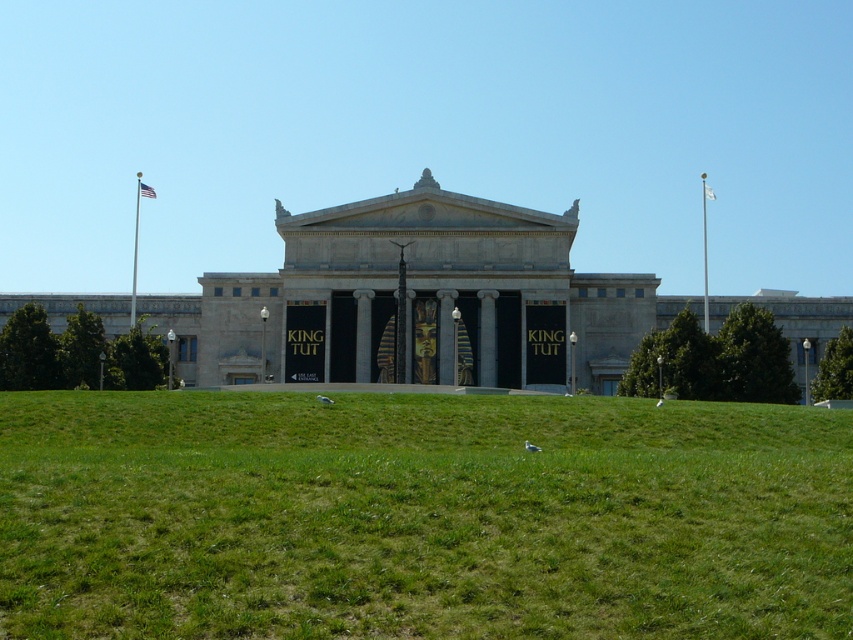
Is green grass at lower center in front of metallic flag pole at upper center?

That is True.

This screenshot has height=640, width=853. What are the coordinates of `green grass at lower center` in the screenshot? It's located at (421, 516).

Locate an element on the screen. green grass at lower center is located at coordinates (421, 516).

Does metallic flag pole at left have a smaller size compared to metallic flag pole at upper center?

Indeed, metallic flag pole at left has a smaller size compared to metallic flag pole at upper center.

Between metallic flag pole at left and metallic flag pole at upper center, which one has more height?

metallic flag pole at left is taller.

The image size is (853, 640). I want to click on metallic flag pole at left, so click(x=136, y=244).

Does green grass at lower center have a smaller size compared to metallic flag pole at left?

No.

Can you confirm if green grass at lower center is positioned to the left of metallic flag pole at left?

In fact, green grass at lower center is to the right of metallic flag pole at left.

Find the location of `green grass at lower center`. green grass at lower center is located at coordinates (421, 516).